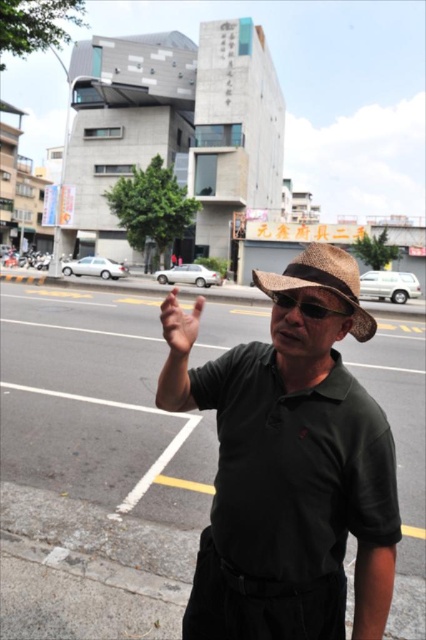
In the scene shown: Who is taller, dark green polo shirt at center or woven straw hat at center?

dark green polo shirt at center is taller.

This screenshot has width=426, height=640. Find the location of `dark green polo shirt at center`. dark green polo shirt at center is located at coordinates (293, 465).

Between point (302, 280) and point (328, 314), which one is positioned in front?

Positioned in front is point (328, 314).

Does woven straw hat at center appear on the left side of black plastic goggles at center?

Incorrect, woven straw hat at center is not on the left side of black plastic goggles at center.

Identify the location of woven straw hat at center. This screenshot has width=426, height=640. (322, 282).

What are the coordinates of `woven straw hat at center` in the screenshot? It's located at (322, 282).

Measure the distance between dark green polo shirt at center and camera.

dark green polo shirt at center is 1.09 meters away from camera.

Can you confirm if dark green polo shirt at center is bigger than black plastic goggles at center?

Yes.

Is point (317, 579) more distant than point (325, 314)?

Yes.

In order to click on dark green polo shirt at center in this screenshot , I will do `click(293, 465)`.